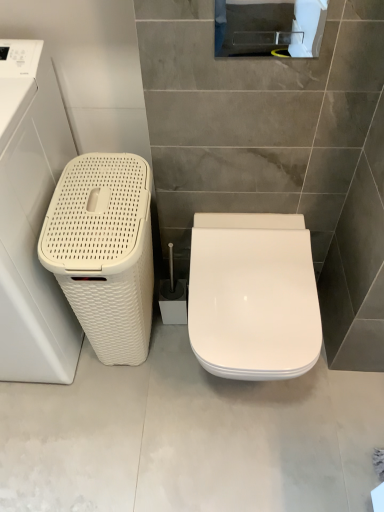
You are a GUI agent. You are given a task and a screenshot of the screen. Output one action in this format:
    pyautogui.click(x=<x>, y=<y>)
    Task: Click on the free location above white woven basket at left (from a real-world perspective)
    
    Given the screenshot: What is the action you would take?
    pyautogui.click(x=100, y=196)